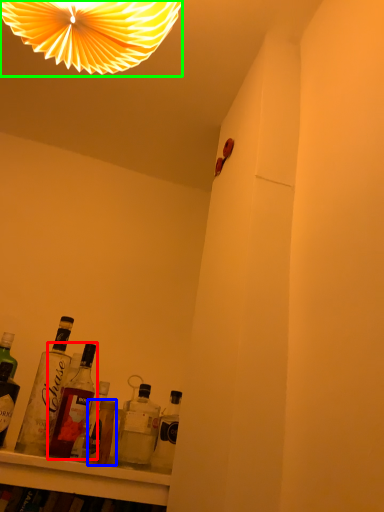
Question: Which object is positioned closest to bottle (highlighted by a red box)? Select from bottle (highlighted by a blue box) and lamp (highlighted by a green box).

Choices:
 (A) bottle
 (B) lamp

Answer: (A)